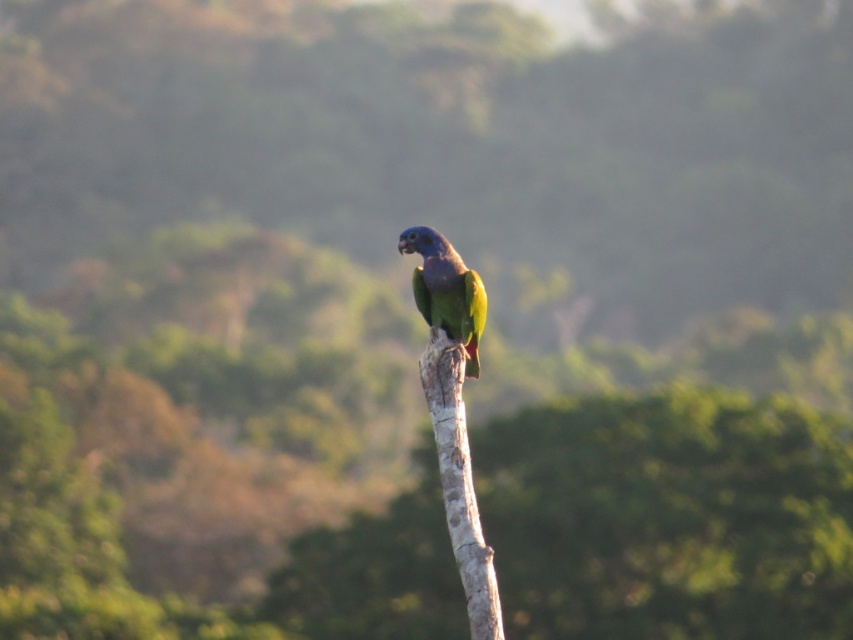
This screenshot has width=853, height=640. What do you see at coordinates (459, 483) in the screenshot?
I see `smooth bark tree branch at center` at bounding box center [459, 483].

Who is more distant from viewer, (457, 476) or (451, 268)?

Positioned behind is point (451, 268).

Where is `smooth bark tree branch at center`? smooth bark tree branch at center is located at coordinates (459, 483).